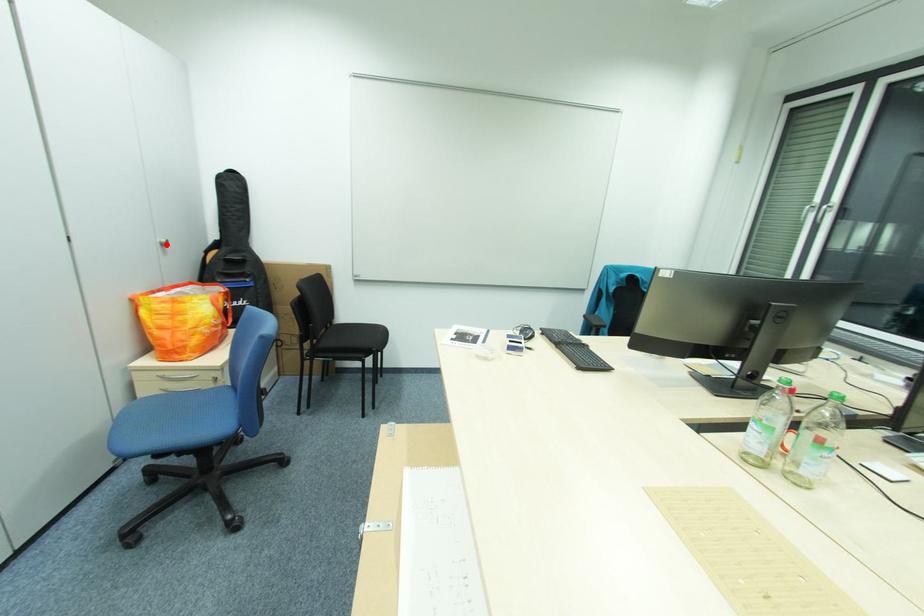
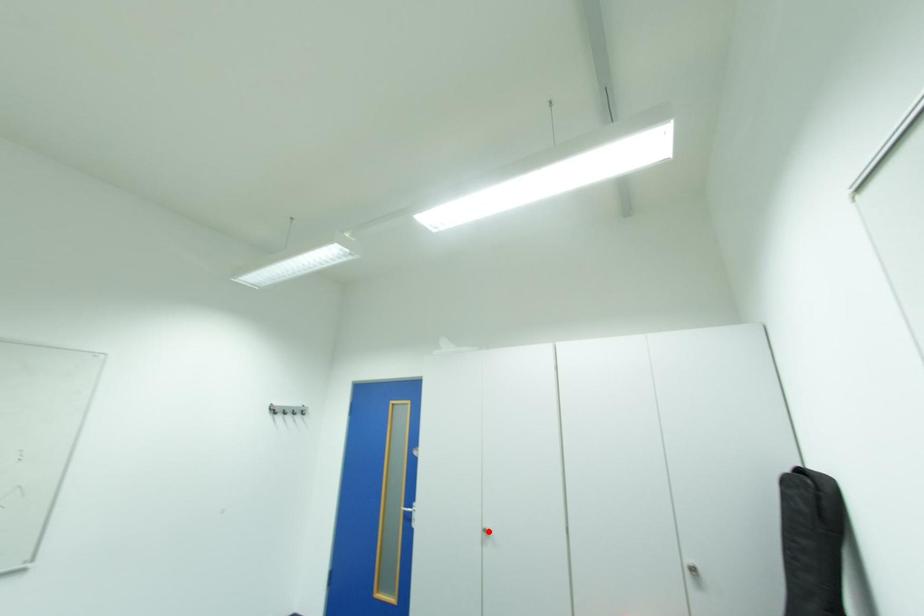
I am providing you with two images of the same scene from different viewpoints. A red point is marked on the first image and another point is marked on the second image. Is the red point in image1 aligned with the point shown in image2?

No